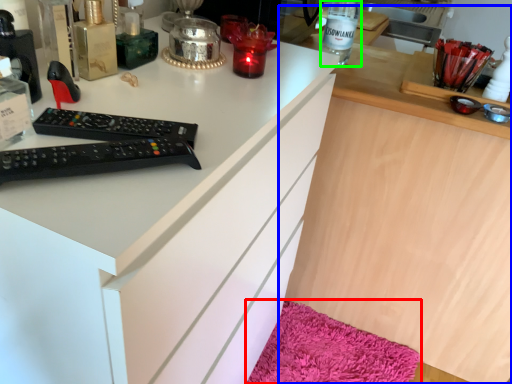
Question: Considering the real-world distances, which object is farthest from bath mat (highlighted by a red box)? computer (highlighted by a blue box) or bottle (highlighted by a green box)?

Choices:
 (A) computer
 (B) bottle

Answer: (B)